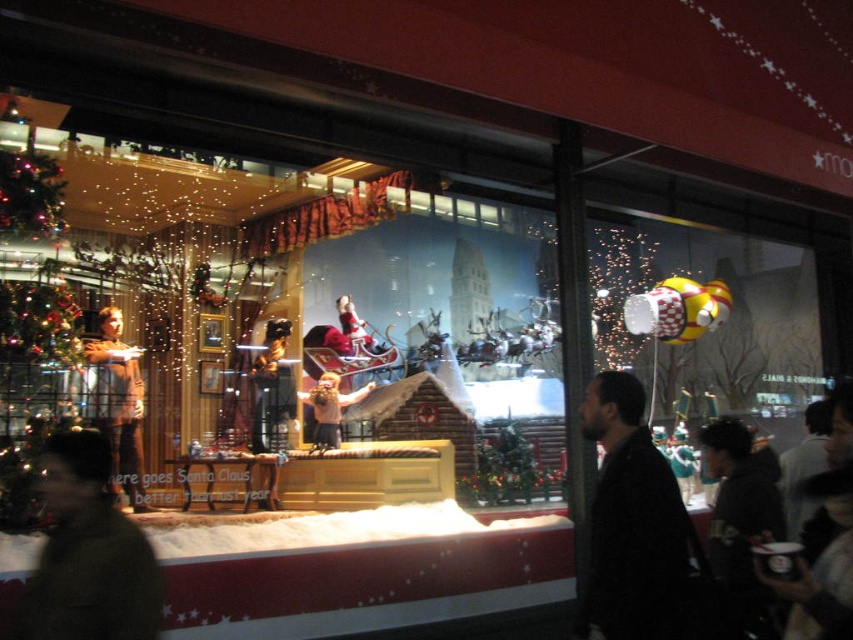
How distant is black wool coat at right from brown leather jacket at center?

They are 8.21 feet apart.

Does black wool coat at right have a smaller size compared to brown leather jacket at center?

No.

The width and height of the screenshot is (853, 640). What do you see at coordinates (633, 522) in the screenshot?
I see `black wool coat at right` at bounding box center [633, 522].

Identify the location of black wool coat at right. (633, 522).

Looking at this image, which is above, green wool coat at lower left or brown leather jacket at center?

Positioned higher is brown leather jacket at center.

Is point (97, 486) positioned behind point (337, 384)?

No, (97, 486) is closer to viewer.

Locate an element on the screen. green wool coat at lower left is located at coordinates (88, 554).

Does black wool coat at right lie behind green wool coat at lower left?

Yes, black wool coat at right is further from the viewer.

Is the position of black wool coat at right less distant than that of green wool coat at lower left?

No.

Is point (666, 580) farther from viewer compared to point (93, 506)?

That is True.

Identify the location of black wool coat at right. (633, 522).